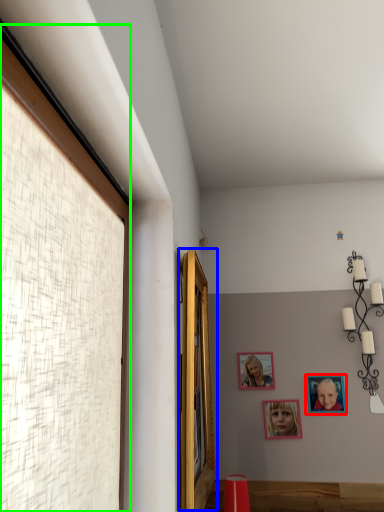
Question: Considering the real-world distances, which object is closest to picture frame (highlighted by a red box)? window (highlighted by a blue box) or window (highlighted by a green box).

Choices:
 (A) window
 (B) window

Answer: (A)